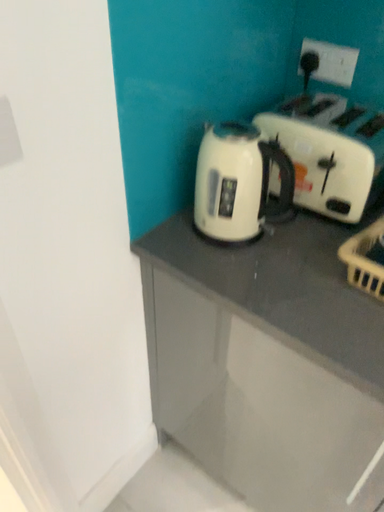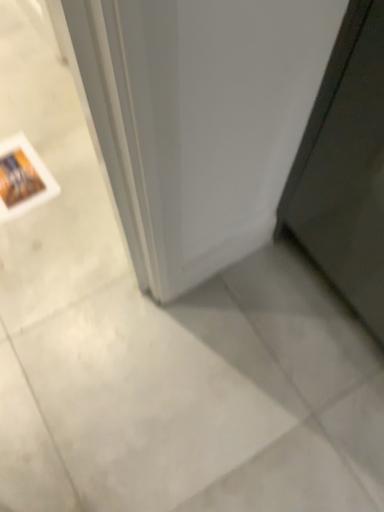
Question: How did the camera likely rotate when shooting the video?

Choices:
 (A) rotated downward
 (B) rotated upward

Answer: (A)